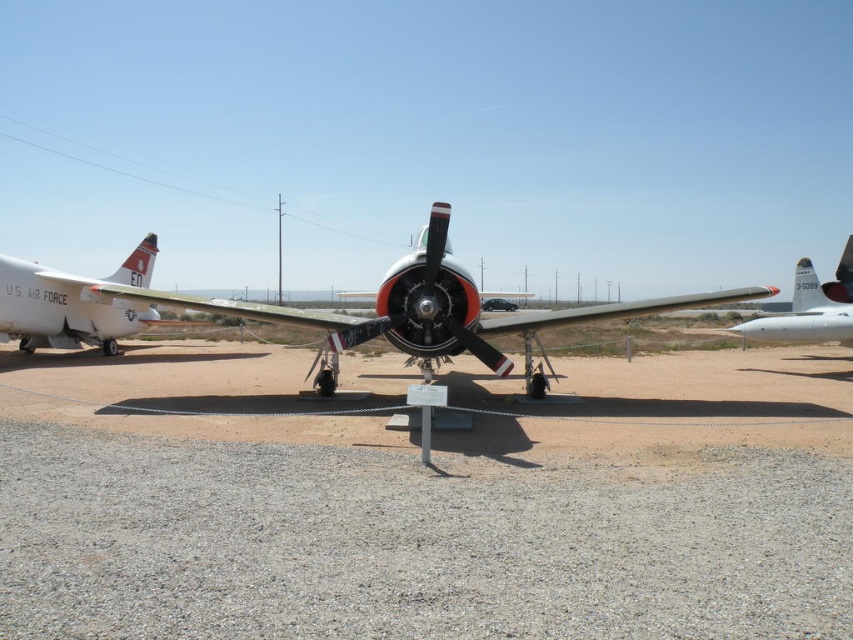
Question: Which point is farther from the camera taking this photo?

Choices:
 (A) (798, 321)
 (B) (3, 280)

Answer: (B)

Question: Does gray gravel at center appear on the left side of polished silver propeller at center?

Choices:
 (A) no
 (B) yes

Answer: (A)

Question: Which object appears closest to the camera in this image?

Choices:
 (A) gray gravel at center
 (B) metallic silver airplane at center
 (C) silver metallic airplane at right
 (D) polished silver propeller at center

Answer: (A)

Question: Can you confirm if gray gravel at center is positioned above metallic silver airplane at center?

Choices:
 (A) yes
 (B) no

Answer: (B)

Question: Which point appears farthest from the camera in this image?

Choices:
 (A) (759, 317)
 (B) (498, 360)
 (C) (131, 358)
 (D) (146, 273)

Answer: (D)

Question: Observing the image, what is the correct spatial positioning of gray gravel at center in reference to metallic silver airplane at center?

Choices:
 (A) below
 (B) above

Answer: (A)